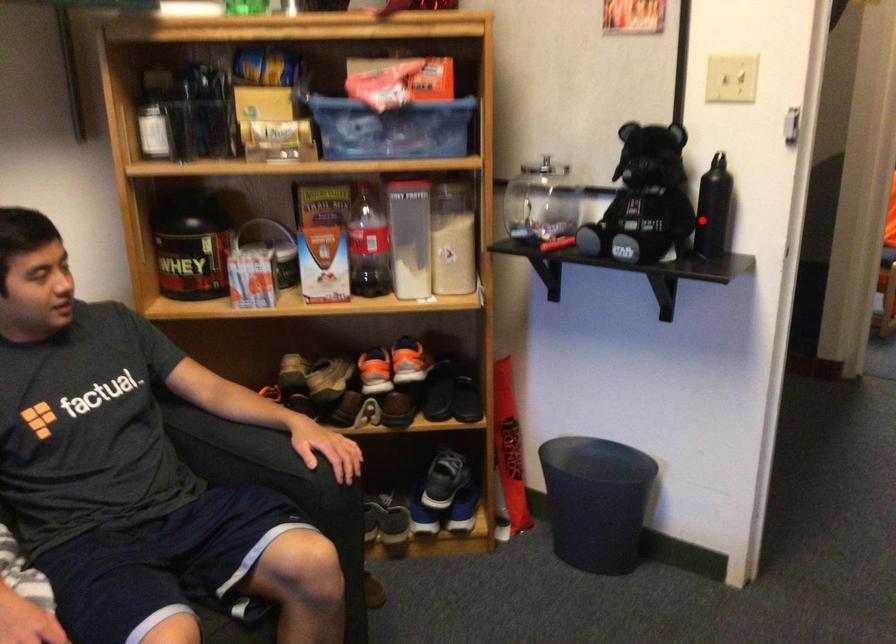
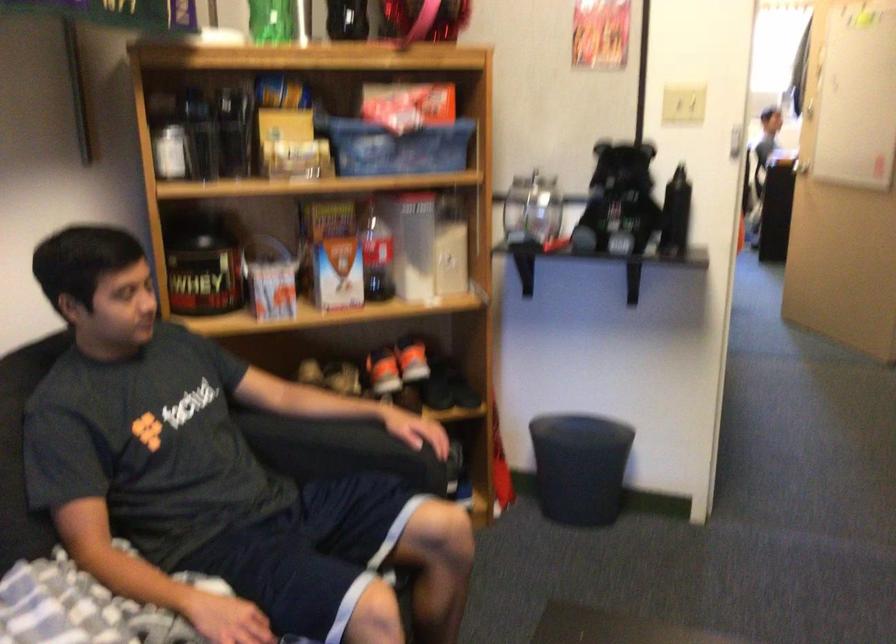
Question: I am providing you with two images of the same scene from different viewpoints. In image1, a red point is highlighted. Considering the same 3D point in image2, which of the following is correct?

Choices:
 (A) It is closer
 (B) It is farther

Answer: (B)